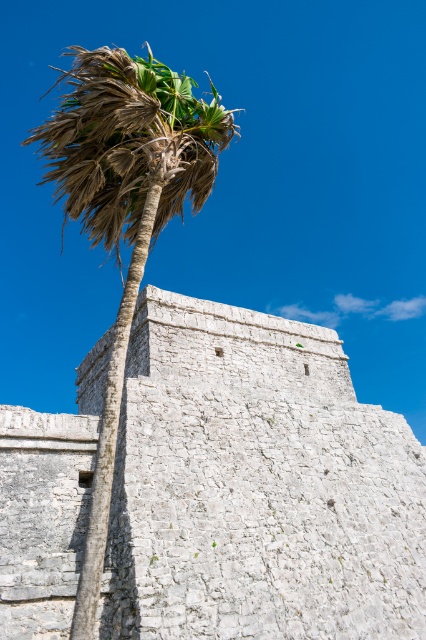
Looking at this image, you are an architect analyzing the spatial relationship between the white stone wall at center and the brown leafy palm tree at left. Based on the scene, which object is located above the other?

The brown leafy palm tree at left is positioned above the white stone wall at center, as the description states that the wall is under the palm tree.

You are standing at the point marked by the coordinates point [256,486] in the image. What object are you facing?

The point [256,486] indicates the white stone wall at center, so you are facing the white stone wall at center.